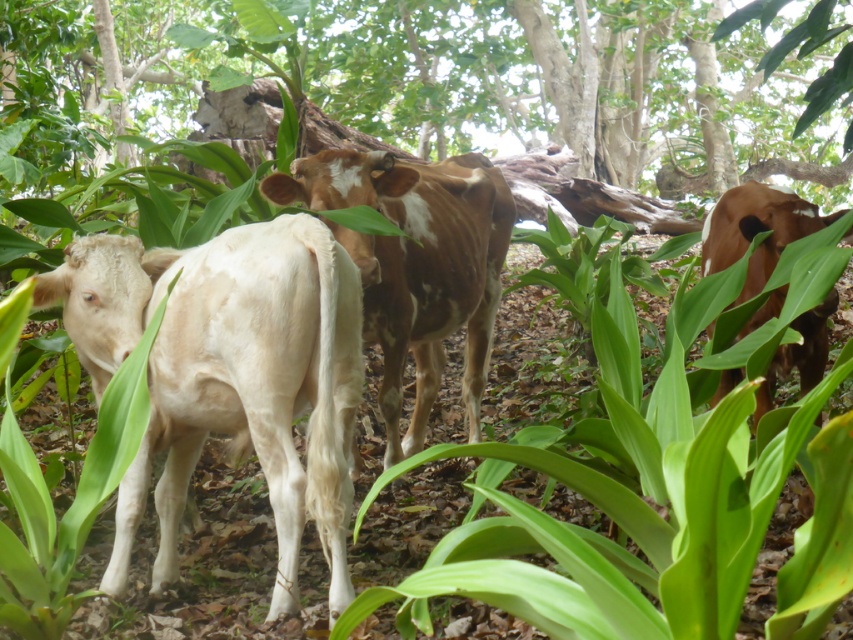
In the scene shown: You are standing in the forest and want to take a photo of the cows. You notice two points in the scene marked as point 1 at coordinates point (349, 394) and point 2 at coordinates point (399, 164). Which point is closer to your camera to ensure the cows are in focus?

Point 1 at coordinates point (349, 394) is closer to the camera than point 2 at coordinates point (399, 164), so focusing on point 1 will ensure the cows are in focus.

You are navigating through a dense forest and spot a white smooth cow at left. Can you determine its exact coordinates in the scene?

The white smooth cow at left is located at coordinates point (x=229, y=376).

You are standing at point A located at coordinates point A at (480, 305). You want to walk to the nearest cow. Which cow should you head towards?

The two brown and white cows on the right are closer to point A at (480, 305) than the white cow on the left. Therefore, you should head towards the two brown and white cows on the right.